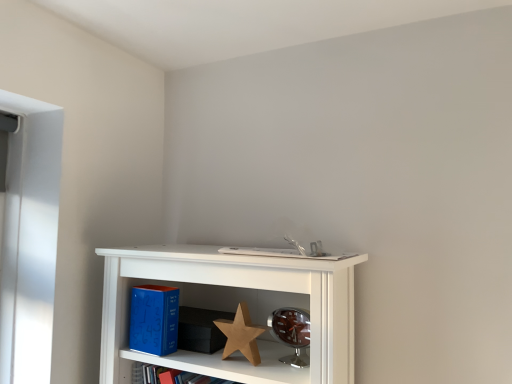
Question: Is white matte book at center in front of or behind wooden star at center in the image?

Choices:
 (A) front
 (B) behind

Answer: (B)

Question: Visually, is white matte book at center positioned to the left or to the right of wooden star at center?

Choices:
 (A) right
 (B) left

Answer: (A)

Question: Which of these objects is positioned farthest from the white matte book at center?

Choices:
 (A) wooden star at center
 (B) blue matte book at lower left

Answer: (B)

Question: Which of these objects is positioned farthest from the white matte book at center?

Choices:
 (A) wooden star at center
 (B) blue matte book at lower left

Answer: (B)